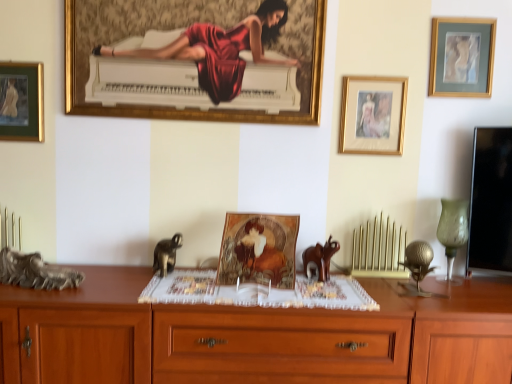
Describe the element at coordinates (21, 101) in the screenshot. This screenshot has width=512, height=384. I see `green matte picture frame at upper left, the 4th picture frame in the right-to-left sequence` at that location.

Describe the element at coordinates (196, 60) in the screenshot. The height and width of the screenshot is (384, 512). I see `gold-framed painting at upper center, the second picture frame from the left` at that location.

Where is `gold-framed painting at upper center, the second picture frame from the left`? The height and width of the screenshot is (384, 512). gold-framed painting at upper center, the second picture frame from the left is located at coordinates (196, 60).

What do you see at coordinates (166, 254) in the screenshot?
I see `metallic gray monkey at center-left, the second animal viewed from the left` at bounding box center [166, 254].

Locate an element on the screen. The image size is (512, 384). green matte picture frame at upper left, the 1th picture frame when ordered from left to right is located at coordinates (21, 101).

What's the angular difference between gold-framed picture at center-right, which ranks as the second picture frame in right-to-left order, and rustic wood sculpture at left, the 3th animal when ordered from right to left,'s facing directions?

gold-framed picture at center-right, which ranks as the second picture frame in right-to-left order, and rustic wood sculpture at left, the 3th animal when ordered from right to left, are facing 1.05 degrees away from each other.

From the image's perspective, is gold-framed picture at center-right, the third picture frame in the left-to-right sequence, located above or below rustic wood sculpture at left, marked as the first animal in a left-to-right arrangement?

Clearly, from the image's perspective, gold-framed picture at center-right, the third picture frame in the left-to-right sequence, is above rustic wood sculpture at left, marked as the first animal in a left-to-right arrangement.

Are gold-framed picture at center-right, the third picture frame in the left-to-right sequence, and rustic wood sculpture at left, the 3th animal when ordered from right to left, making contact?

gold-framed picture at center-right, the third picture frame in the left-to-right sequence, is not next to rustic wood sculpture at left, the 3th animal when ordered from right to left, and they're not touching.

Considering the relative sizes of metallic gray monkey at center-left, positioned as the 2th animal in right-to-left order, and green matte picture frame at upper left, the 4th picture frame in the right-to-left sequence, in the image provided, is metallic gray monkey at center-left, positioned as the 2th animal in right-to-left order, thinner than green matte picture frame at upper left, the 4th picture frame in the right-to-left sequence,?

No.

Does metallic gray monkey at center-left, the second animal viewed from the left, appear on the right side of green matte picture frame at upper left, the 1th picture frame when ordered from left to right?

Indeed, metallic gray monkey at center-left, the second animal viewed from the left, is positioned on the right side of green matte picture frame at upper left, the 1th picture frame when ordered from left to right.

From the image's perspective, which animal is the 2nd one below the green matte picture frame at upper left, the 1th picture frame when ordered from left to right? Please provide its 2D coordinates.

[(166, 254)]

Based on the photo, from a real-world perspective, relative to green matte picture frame at upper left, the 4th picture frame in the right-to-left sequence, is metallic gray monkey at center-left, positioned as the 2th animal in right-to-left order, vertically above or below?

Clearly, from a real-world perspective, metallic gray monkey at center-left, positioned as the 2th animal in right-to-left order, is below green matte picture frame at upper left, the 4th picture frame in the right-to-left sequence.

How far apart are gold-framed picture at center-right, the third picture frame in the left-to-right sequence, and gold-framed painting at upper center, placed as the 3th picture frame when sorted from right to left?

They are 17.84 inches apart.

Are gold-framed picture at center-right, the third picture frame in the left-to-right sequence, and gold-framed painting at upper center, the second picture frame from the left, located far from each other?

That's not correct — gold-framed picture at center-right, the third picture frame in the left-to-right sequence, is a little close to gold-framed painting at upper center, the second picture frame from the left.

Is gold-framed picture at center-right, the third picture frame in the left-to-right sequence, facing towards gold-framed painting at upper center, the second picture frame from the left?

No.

Does point (347, 96) lie in front of point (237, 121)?

No, (347, 96) is behind (237, 121).

Considering the positions of points (396, 137) and (333, 379), is point (396, 137) farther from camera compared to point (333, 379)?

Yes, it is.

From a real-world perspective, which picture frame is the 2nd one above the wooden drawer at center? Please provide its 2D coordinates.

[(373, 115)]

Looking at this image, is gold-framed picture at center-right, which ranks as the second picture frame in right-to-left order, next to wooden drawer at center and touching it?

No, gold-framed picture at center-right, which ranks as the second picture frame in right-to-left order, is not beside wooden drawer at center.

Looking at this image, between gold-framed picture at center-right, which ranks as the second picture frame in right-to-left order, and wooden drawer at center, which one is positioned in front?

wooden drawer at center is more forward.

From the image's perspective, is gold-framed artwork at upper right, positioned as the first picture frame in right-to-left order, located beneath gold-framed painting at upper center, placed as the 3th picture frame when sorted from right to left?

No.

Is gold-framed artwork at upper right, positioned as the first picture frame in right-to-left order, wider than gold-framed painting at upper center, placed as the 3th picture frame when sorted from right to left?

No, gold-framed artwork at upper right, positioned as the first picture frame in right-to-left order, is not wider than gold-framed painting at upper center, placed as the 3th picture frame when sorted from right to left.

Consider the image. From a real-world perspective, relative to gold-framed painting at upper center, placed as the 3th picture frame when sorted from right to left, is gold-framed artwork at upper right, positioned as the first picture frame in right-to-left order, vertically above or below?

Clearly, from a real-world perspective, gold-framed artwork at upper right, positioned as the first picture frame in right-to-left order, is above gold-framed painting at upper center, placed as the 3th picture frame when sorted from right to left.

Can you confirm if gold-framed artwork at upper right, positioned as the first picture frame in right-to-left order, is smaller than gold-framed painting at upper center, the second picture frame from the left?

Indeed, gold-framed artwork at upper right, positioned as the first picture frame in right-to-left order, has a smaller size compared to gold-framed painting at upper center, the second picture frame from the left.

Does gold-framed artwork at upper right, positioned as the first picture frame in right-to-left order, have a greater height compared to brown matte elephant at center, the 3th animal from the left?

Yes.

Is brown matte elephant at center, the 3th animal from the left, surrounded by gold-framed artwork at upper right, which is the 4th picture frame in left-to-right order?

No, gold-framed artwork at upper right, which is the 4th picture frame in left-to-right order, does not contain brown matte elephant at center, the 3th animal from the left.

Which of these two, gold-framed artwork at upper right, which is the 4th picture frame in left-to-right order, or brown matte elephant at center, the first animal from the right, is bigger?

Bigger between the two is brown matte elephant at center, the first animal from the right.

Visually, is gold-framed artwork at upper right, which is the 4th picture frame in left-to-right order, positioned to the left or to the right of brown matte elephant at center, the 3th animal from the left?

gold-framed artwork at upper right, which is the 4th picture frame in left-to-right order, is positioned on brown matte elephant at center, the 3th animal from the left,'s right side.

Is green matte picture frame at upper left, the 4th picture frame in the right-to-left sequence, not close to metallic gray monkey at center-left, the second animal viewed from the left?

No.

From the picture: From a real-world perspective, is green matte picture frame at upper left, the 1th picture frame when ordered from left to right, on top of metallic gray monkey at center-left, positioned as the 2th animal in right-to-left order?

Indeed, from a real-world perspective, green matte picture frame at upper left, the 1th picture frame when ordered from left to right, stands above metallic gray monkey at center-left, positioned as the 2th animal in right-to-left order.

In the scene shown: Who is shorter, green matte picture frame at upper left, the 4th picture frame in the right-to-left sequence, or metallic gray monkey at center-left, the second animal viewed from the left?

metallic gray monkey at center-left, the second animal viewed from the left.

Between green matte picture frame at upper left, the 1th picture frame when ordered from left to right, and metallic gray monkey at center-left, positioned as the 2th animal in right-to-left order, which one has smaller size?

Smaller between the two is green matte picture frame at upper left, the 1th picture frame when ordered from left to right.

You are a GUI agent. You are given a task and a screenshot of the screen. Output one action in this format:
    pyautogui.click(x=<x>, y=<y>)
    Task: Click on the 3rd animal counting from the left side of the gold-framed picture at center-right, which ranks as the second picture frame in right-to-left order
    This screenshot has width=512, height=384.
    Given the screenshot: What is the action you would take?
    pyautogui.click(x=35, y=272)

Which animal is the 2nd one when counting from the front of the green matte picture frame at upper left, the 1th picture frame when ordered from left to right? Please provide its 2D coordinates.

[(166, 254)]

Which object lies nearer to the anchor point gold-framed picture at center-right, which ranks as the second picture frame in right-to-left order, brown matte elephant at center, the 3th animal from the left, or wooden cabinet at lower left?

brown matte elephant at center, the 3th animal from the left, lies closer to gold-framed picture at center-right, which ranks as the second picture frame in right-to-left order, than the other object.

Looking at the image, which one is located closer to gold-framed picture at center-right, which ranks as the second picture frame in right-to-left order, brown matte elephant at center, the first animal from the right, or rustic wood sculpture at left, the 3th animal when ordered from right to left?

brown matte elephant at center, the first animal from the right, is positioned closer to the anchor gold-framed picture at center-right, which ranks as the second picture frame in right-to-left order.

Looking at this image, based on their spatial positions, is rustic wood sculpture at left, marked as the first animal in a left-to-right arrangement, or gold-framed painting at upper center, the second picture frame from the left, closer to metallic gray monkey at center-left, the second animal viewed from the left?

rustic wood sculpture at left, marked as the first animal in a left-to-right arrangement.

Considering their positions, is gold-framed artwork at upper right, positioned as the first picture frame in right-to-left order, positioned closer to green glass vase at right than gold-framed picture at center-right, which ranks as the second picture frame in right-to-left order?

The object closer to green glass vase at right is gold-framed picture at center-right, which ranks as the second picture frame in right-to-left order.

When comparing their distances from gold-framed artwork at upper right, which is the 4th picture frame in left-to-right order, does green glass vase at right or brown matte elephant at center, the first animal from the right, seem further?

The object further to gold-framed artwork at upper right, which is the 4th picture frame in left-to-right order, is brown matte elephant at center, the first animal from the right.

Considering their positions, is green glass vase at right positioned closer to green matte picture frame at upper left, the 4th picture frame in the right-to-left sequence, than brown matte elephant at center, the 3th animal from the left?

brown matte elephant at center, the 3th animal from the left.

Which object lies further to the anchor point wooden drawer at center, brown matte elephant at center, the 3th animal from the left, or rustic wood sculpture at left, the 3th animal when ordered from right to left?

rustic wood sculpture at left, the 3th animal when ordered from right to left, is positioned further to the anchor wooden drawer at center.

Estimate the real-world distances between objects in this image. Which object is closer to wooden cabinet at lower left, green matte picture frame at upper left, the 1th picture frame when ordered from left to right, or gold-framed picture at center-right, which ranks as the second picture frame in right-to-left order?

green matte picture frame at upper left, the 1th picture frame when ordered from left to right, lies closer to wooden cabinet at lower left than the other object.

At what (x,y) coordinates should I click in order to perform the action: click on drawer between green matte picture frame at upper left, the 4th picture frame in the right-to-left sequence, and gold-framed picture at center-right, the third picture frame in the left-to-right sequence, in the horizontal direction. Please return your answer as a coordinate pair (x, y). Looking at the image, I should click on (279, 348).

In order to click on animal located between gold-framed painting at upper center, placed as the 3th picture frame when sorted from right to left, and green glass vase at right in the left-right direction in this screenshot , I will do `click(321, 257)`.

Where is `drawer situated between green matte picture frame at upper left, the 1th picture frame when ordered from left to right, and gold-framed artwork at upper right, which is the 4th picture frame in left-to-right order, from left to right`? Image resolution: width=512 pixels, height=384 pixels. drawer situated between green matte picture frame at upper left, the 1th picture frame when ordered from left to right, and gold-framed artwork at upper right, which is the 4th picture frame in left-to-right order, from left to right is located at coordinates (279, 348).

Locate an element on the screen. This screenshot has height=384, width=512. drawer between rustic wood sculpture at left, the 3th animal when ordered from right to left, and brown matte elephant at center, the first animal from the right is located at coordinates (279, 348).